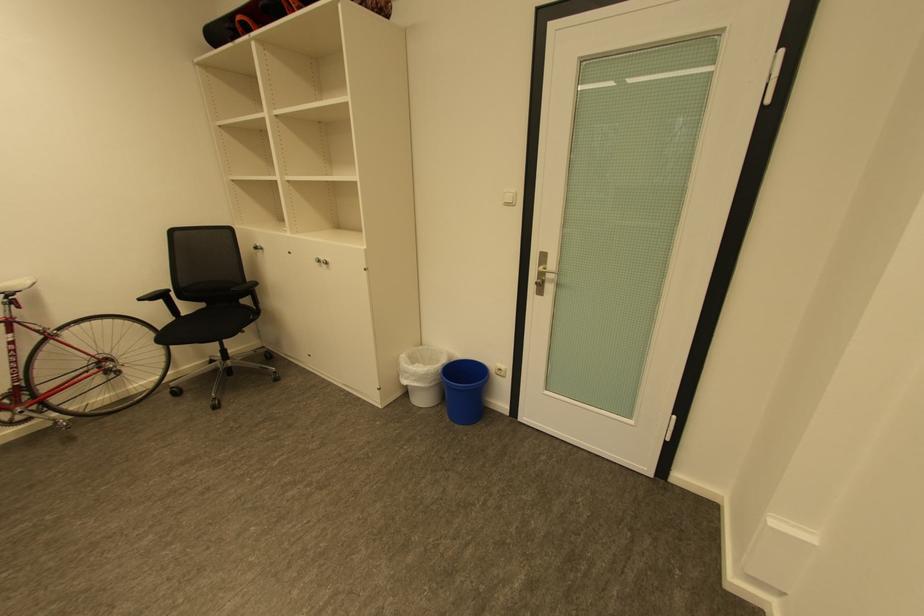
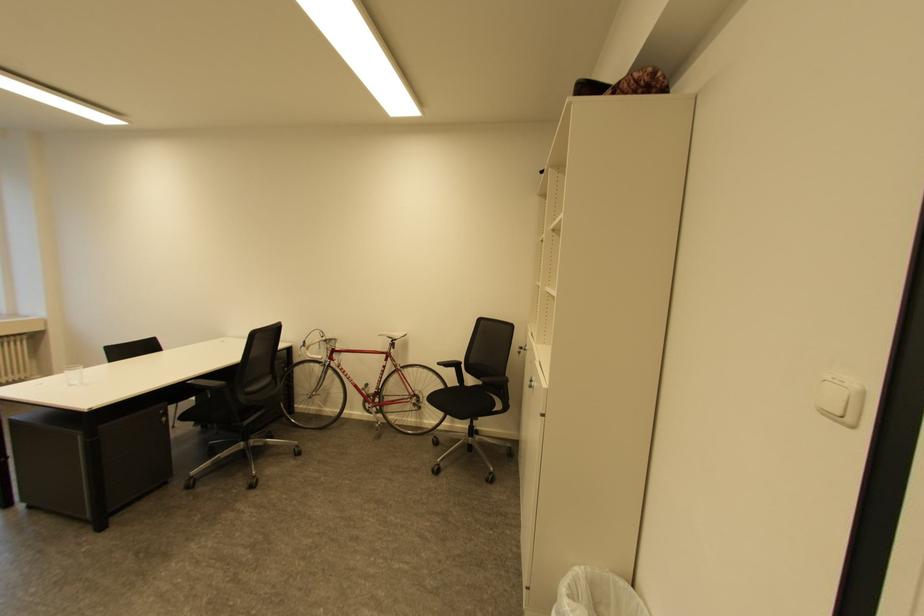
The point at [407,357] is marked in the first image. Where is the corresponding point in the second image?

(579, 569)